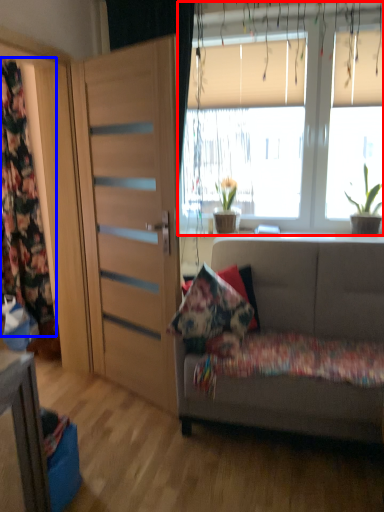
Question: Which object appears farthest to the camera in this image, window (highlighted by a red box) or curtain (highlighted by a blue box)?

Choices:
 (A) window
 (B) curtain

Answer: (B)